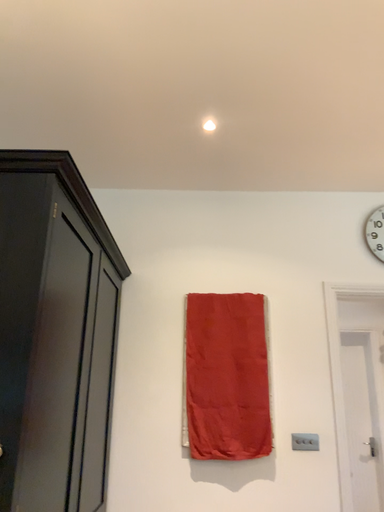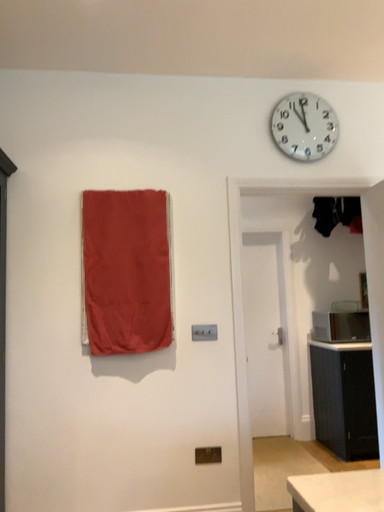
Question: How did the camera likely rotate when shooting the video?

Choices:
 (A) rotated right
 (B) rotated left

Answer: (A)